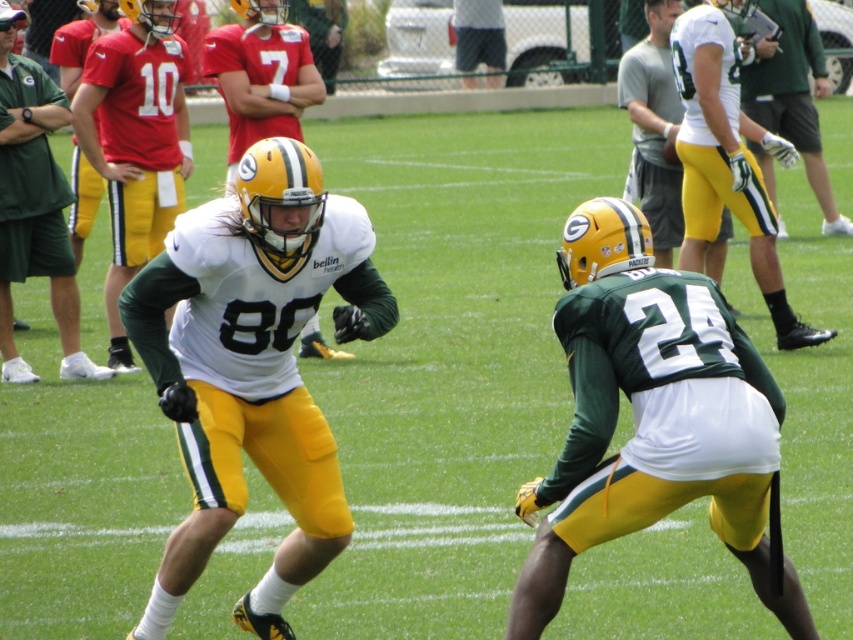
Question: Considering the relative positions of green matte jersey at center and matte green helmet at left in the image provided, where is green matte jersey at center located with respect to matte green helmet at left?

Choices:
 (A) right
 (B) left

Answer: (A)

Question: Which object appears closest to the camera in this image?

Choices:
 (A) green matte helmet at upper right
 (B) matte green helmet at left
 (C) white matte jersey at upper right
 (D) white matte jersey at center

Answer: (D)

Question: Considering the real-world distances, which object is farthest from the white matte jersey at upper right?

Choices:
 (A) white jersey at upper right
 (B) white matte jersey at center
 (C) matte green helmet at left

Answer: (B)

Question: Can you confirm if green matte jersey at center is bigger than matte green helmet at left?

Choices:
 (A) no
 (B) yes

Answer: (A)

Question: Which of the following is the closest to the observer?

Choices:
 (A) (727, 214)
 (B) (190, 378)
 (C) (695, 429)
 (D) (62, 228)

Answer: (C)

Question: Does white matte jersey at center come behind white jersey at upper right?

Choices:
 (A) no
 (B) yes

Answer: (A)